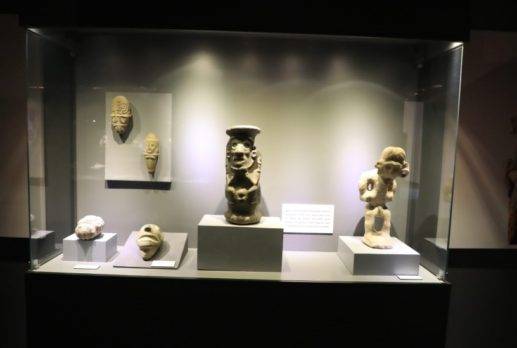
Find the location of a particular element. The width and height of the screenshot is (517, 348). mounted carvings is located at coordinates [x=150, y=240], [x=151, y=157], [x=120, y=111].